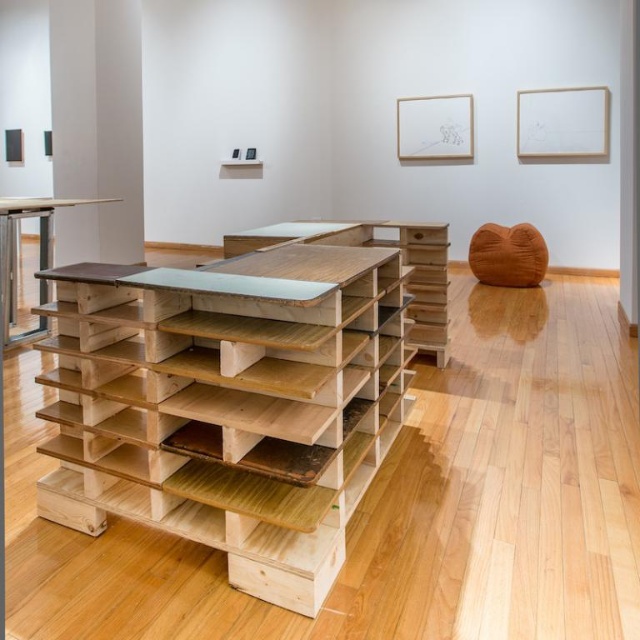
Is point (61, 340) positioned behind point (12, 282)?

That is False.

Between point (268, 353) and point (45, 205), which one is positioned in front?

Point (268, 353) is in front.

Between point (81, 483) and point (12, 216), which one is positioned behind?

The point (12, 216) is behind.

Image resolution: width=640 pixels, height=640 pixels. I want to click on natural wood bookshelf at center, so click(230, 406).

Which of these two, natural wood table at left or clear glass table at center, stands taller?

With more height is natural wood table at left.

Who is more forward, (4, 294) or (236, 243)?

Positioned in front is point (236, 243).

At what (x,y) coordinates should I click in order to perform the action: click on natural wood table at left. Please return your answer as a coordinate pair (x, y). Looking at the image, I should click on (17, 253).

You are a GUI agent. You are given a task and a screenshot of the screen. Output one action in this format:
    pyautogui.click(x=<x>, y=<y>)
    Task: Click on the natural wood bookshelf at center
    This screenshot has width=640, height=640.
    Given the screenshot: What is the action you would take?
    pyautogui.click(x=230, y=406)

Is point (172, 364) more distant than point (291, 236)?

No, (172, 364) is closer to viewer.

I want to click on natural wood bookshelf at center, so click(x=230, y=406).